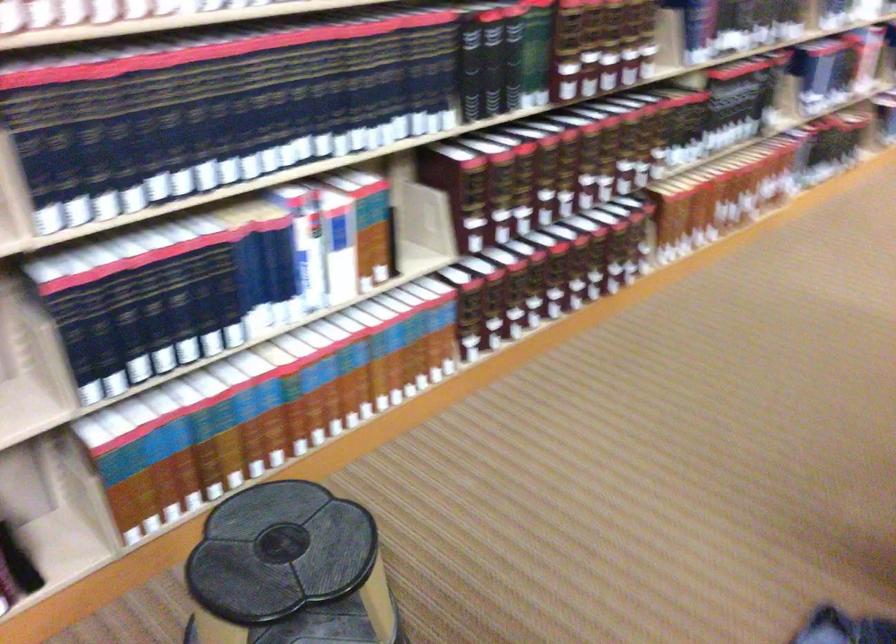
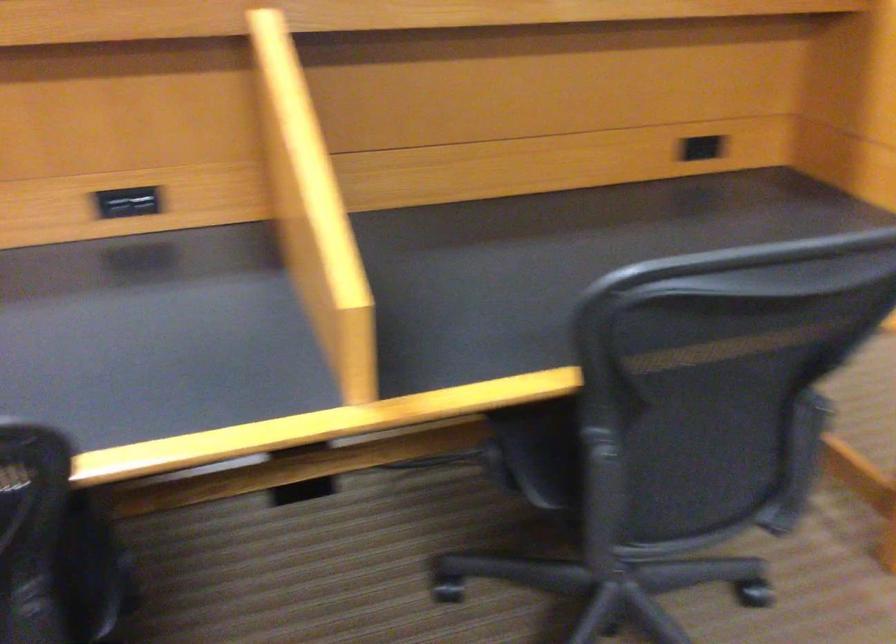
Question: I am providing you with two images of the same scene from different viewpoints. Which of the following objects are not visible in image2?

Choices:
 (A) chair sitting surface
 (B) red container handle
 (C) chair armrest
 (D) black spine book

Answer: (D)